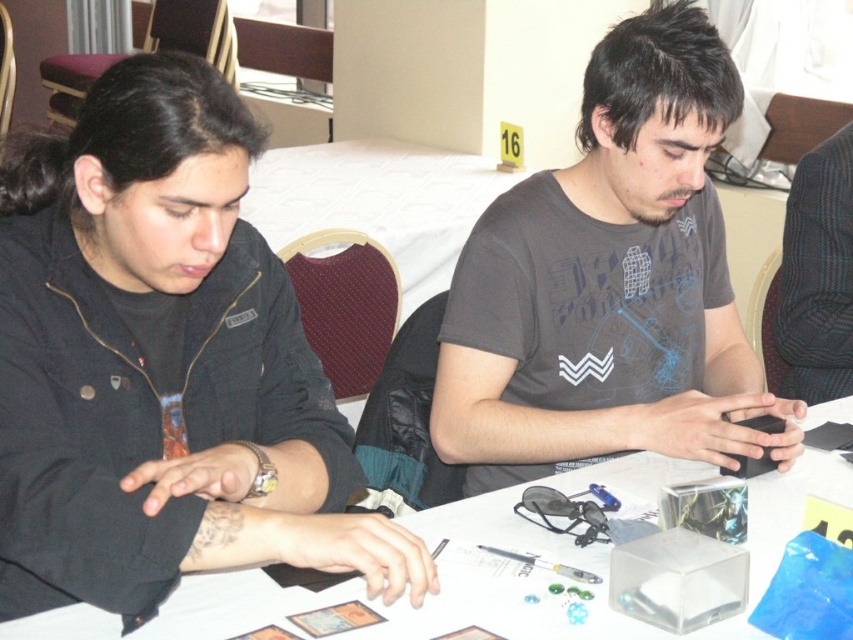
Question: Is black matte jacket at upper left bigger than white paper at center?

Choices:
 (A) yes
 (B) no

Answer: (B)

Question: Is black matte jacket at upper left thinner than white paper at center?

Choices:
 (A) no
 (B) yes

Answer: (B)

Question: Which object is positioned closest to the black matte jacket at upper left?

Choices:
 (A) matte gray t-shirt at center
 (B) white paper at center

Answer: (B)

Question: Considering the real-world distances, which object is farthest from the white paper at center?

Choices:
 (A) black matte jacket at upper left
 (B) matte gray t-shirt at center

Answer: (B)

Question: Can you confirm if black matte jacket at upper left is bigger than white paper at center?

Choices:
 (A) yes
 (B) no

Answer: (B)

Question: Which of the following is the farthest from the observer?

Choices:
 (A) (630, 221)
 (B) (195, 592)
 (C) (189, 282)

Answer: (A)